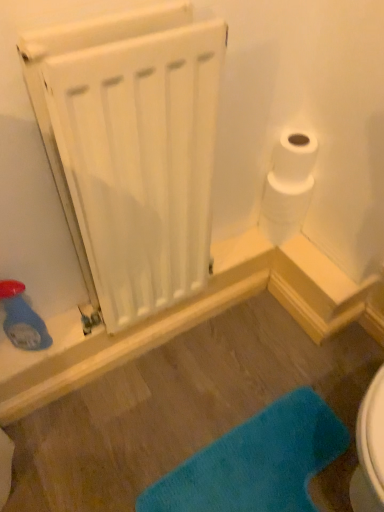
This screenshot has height=512, width=384. Identify the location of white matte toilet paper at upper right. (284, 207).

Where is `blue fuzzy bath mat at lower center`? Image resolution: width=384 pixels, height=512 pixels. blue fuzzy bath mat at lower center is located at coordinates [x=256, y=462].

Is blue fuzzy bath mat at lower center not near white matte radiator at upper left?

Actually, blue fuzzy bath mat at lower center and white matte radiator at upper left are a little close together.

Can you confirm if blue fuzzy bath mat at lower center is wider than white matte radiator at upper left?

Correct, the width of blue fuzzy bath mat at lower center exceeds that of white matte radiator at upper left.

From the picture: From a real-world perspective, which is physically below, white matte toilet paper at upper right or blue fuzzy bath mat at lower center?

In real-world perspective, blue fuzzy bath mat at lower center is lower.

How different are the orientations of white matte toilet paper at upper right and blue fuzzy bath mat at lower center in degrees?

88.7 degrees.

Considering the sizes of objects white matte toilet paper at upper right and blue fuzzy bath mat at lower center in the image provided, who is shorter, white matte toilet paper at upper right or blue fuzzy bath mat at lower center?

Standing shorter between the two is blue fuzzy bath mat at lower center.

Where is `bath mat directly beneath the white matte toilet paper at upper right (from a real-world perspective)`? bath mat directly beneath the white matte toilet paper at upper right (from a real-world perspective) is located at coordinates (256, 462).

You are a GUI agent. You are given a task and a screenshot of the screen. Output one action in this format:
    pyautogui.click(x=<x>, y=<y>)
    Task: Click on the radiator above the blue fuzzy bath mat at lower center (from a real-world perspective)
    The height and width of the screenshot is (512, 384).
    Given the screenshot: What is the action you would take?
    pyautogui.click(x=132, y=149)

Are white matte radiator at upper left and blue fuzzy bath mat at lower center far apart?

No, white matte radiator at upper left is not far away from blue fuzzy bath mat at lower center.

From a real-world perspective, which is physically below, white matte radiator at upper left or blue fuzzy bath mat at lower center?

From a 3D spatial view, blue fuzzy bath mat at lower center is below.

Does white matte radiator at upper left appear on the left side of blue fuzzy bath mat at lower center?

Correct, you'll find white matte radiator at upper left to the left of blue fuzzy bath mat at lower center.

Is white matte radiator at upper left not close to white matte toilet paper at upper right?

white matte radiator at upper left is actually quite close to white matte toilet paper at upper right.

Considering the relative sizes of white matte radiator at upper left and white matte toilet paper at upper right in the image provided, is white matte radiator at upper left wider than white matte toilet paper at upper right?

Indeed, white matte radiator at upper left has a greater width compared to white matte toilet paper at upper right.

Locate an element on the screen. This screenshot has width=384, height=512. toilet paper below the white matte radiator at upper left (from a real-world perspective) is located at coordinates (284, 207).

Is blue fuzzy bath mat at lower center not inside white matte toilet paper at upper right?

Absolutely, blue fuzzy bath mat at lower center is external to white matte toilet paper at upper right.

Are blue fuzzy bath mat at lower center and white matte toilet paper at upper right far apart?

They are positioned close to each other.

From the image's perspective, is blue fuzzy bath mat at lower center located above or below white matte toilet paper at upper right?

blue fuzzy bath mat at lower center is situated lower than white matte toilet paper at upper right in the image.

Is blue fuzzy bath mat at lower center at the left side of white matte toilet paper at upper right?

Correct, you'll find blue fuzzy bath mat at lower center to the left of white matte toilet paper at upper right.

Which of these two, white matte toilet paper at upper right or white matte radiator at upper left, stands shorter?

white matte toilet paper at upper right is shorter.

Considering the relative sizes of white matte toilet paper at upper right and white matte radiator at upper left in the image provided, is white matte toilet paper at upper right thinner than white matte radiator at upper left?

Yes.

In the scene shown: Considering the positions of objects white matte toilet paper at upper right and white matte radiator at upper left in the image provided, who is in front, white matte toilet paper at upper right or white matte radiator at upper left?

white matte radiator at upper left is closer to the camera.

Based on the photo, considering the relative positions of white matte toilet paper at upper right and white matte radiator at upper left in the image provided, is white matte toilet paper at upper right to the right of white matte radiator at upper left from the viewer's perspective?

Yes, white matte toilet paper at upper right is to the right of white matte radiator at upper left.

The width and height of the screenshot is (384, 512). Find the location of `radiator above the blue fuzzy bath mat at lower center (from the image's perspective)`. radiator above the blue fuzzy bath mat at lower center (from the image's perspective) is located at coordinates (132, 149).

Find the location of a particular element. This screenshot has width=384, height=512. toilet paper behind the blue fuzzy bath mat at lower center is located at coordinates (284, 207).

Looking at the image, which one is located further to white matte toilet paper at upper right, blue fuzzy bath mat at lower center or white matte radiator at upper left?

blue fuzzy bath mat at lower center is positioned further to the anchor white matte toilet paper at upper right.

Considering their positions, is blue fuzzy bath mat at lower center positioned closer to white matte radiator at upper left than white matte toilet paper at upper right?

white matte toilet paper at upper right.

Considering their positions, is white matte radiator at upper left positioned further to white matte toilet paper at upper right than blue fuzzy bath mat at lower center?

blue fuzzy bath mat at lower center is further to white matte toilet paper at upper right.

Which object lies nearer to the anchor point blue fuzzy bath mat at lower center, white matte radiator at upper left or white matte toilet paper at upper right?

white matte toilet paper at upper right is positioned closer to the anchor blue fuzzy bath mat at lower center.

Which object lies further to the anchor point blue fuzzy bath mat at lower center, white matte toilet paper at upper right or white matte radiator at upper left?

white matte radiator at upper left lies further to blue fuzzy bath mat at lower center than the other object.

Considering their positions, is white matte toilet paper at upper right positioned closer to white matte radiator at upper left than blue fuzzy bath mat at lower center?

white matte toilet paper at upper right lies closer to white matte radiator at upper left than the other object.

Image resolution: width=384 pixels, height=512 pixels. In order to click on radiator between white matte toilet paper at upper right and blue fuzzy bath mat at lower center in the up-down direction in this screenshot , I will do `click(132, 149)`.